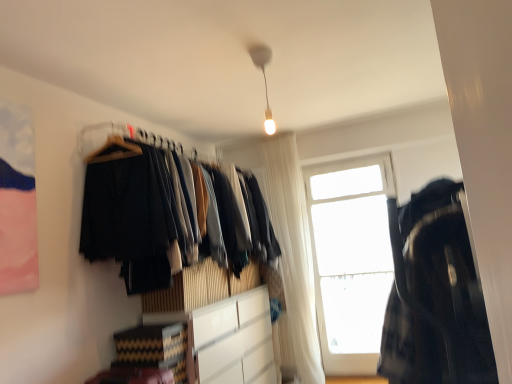
Question: Considering the relative sizes of transparent glass window at upper right and white matte cabinet at center in the image provided, is transparent glass window at upper right shorter than white matte cabinet at center?

Choices:
 (A) no
 (B) yes

Answer: (A)

Question: Is transparent glass window at upper right thinner than white matte cabinet at center?

Choices:
 (A) no
 (B) yes

Answer: (B)

Question: Considering the relative positions of transparent glass window at upper right and white matte cabinet at center in the image provided, is transparent glass window at upper right behind white matte cabinet at center?

Choices:
 (A) yes
 (B) no

Answer: (A)

Question: Is transparent glass window at upper right smaller than white matte cabinet at center?

Choices:
 (A) yes
 (B) no

Answer: (A)

Question: Is the depth of transparent glass window at upper right less than that of white matte cabinet at center?

Choices:
 (A) no
 (B) yes

Answer: (A)

Question: Is transparent glass window at upper right facing towards white matte cabinet at center?

Choices:
 (A) yes
 (B) no

Answer: (B)

Question: Is the depth of white glossy light bulb at upper center greater than that of white sheer curtain at center?

Choices:
 (A) yes
 (B) no

Answer: (B)

Question: Considering the relative sizes of white glossy light bulb at upper center and white sheer curtain at center in the image provided, is white glossy light bulb at upper center wider than white sheer curtain at center?

Choices:
 (A) no
 (B) yes

Answer: (A)

Question: Is white glossy light bulb at upper center oriented towards white sheer curtain at center?

Choices:
 (A) no
 (B) yes

Answer: (A)

Question: From the image's perspective, is white glossy light bulb at upper center above white sheer curtain at center?

Choices:
 (A) no
 (B) yes

Answer: (B)

Question: Is white glossy light bulb at upper center far from white sheer curtain at center?

Choices:
 (A) yes
 (B) no

Answer: (A)

Question: Is white glossy light bulb at upper center oriented away from white sheer curtain at center?

Choices:
 (A) no
 (B) yes

Answer: (A)

Question: Does white matte cabinet at center have a larger size compared to white sheer curtain at center?

Choices:
 (A) no
 (B) yes

Answer: (B)